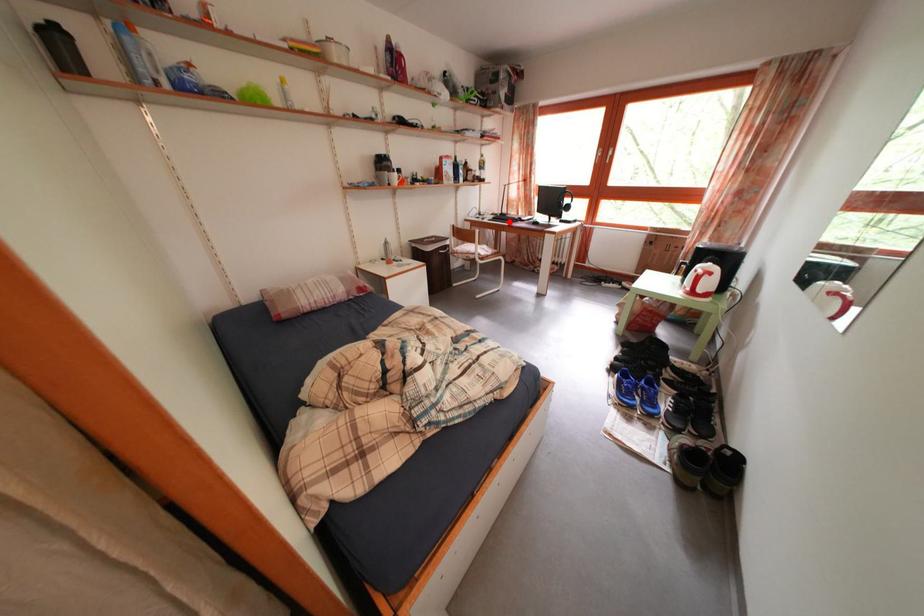
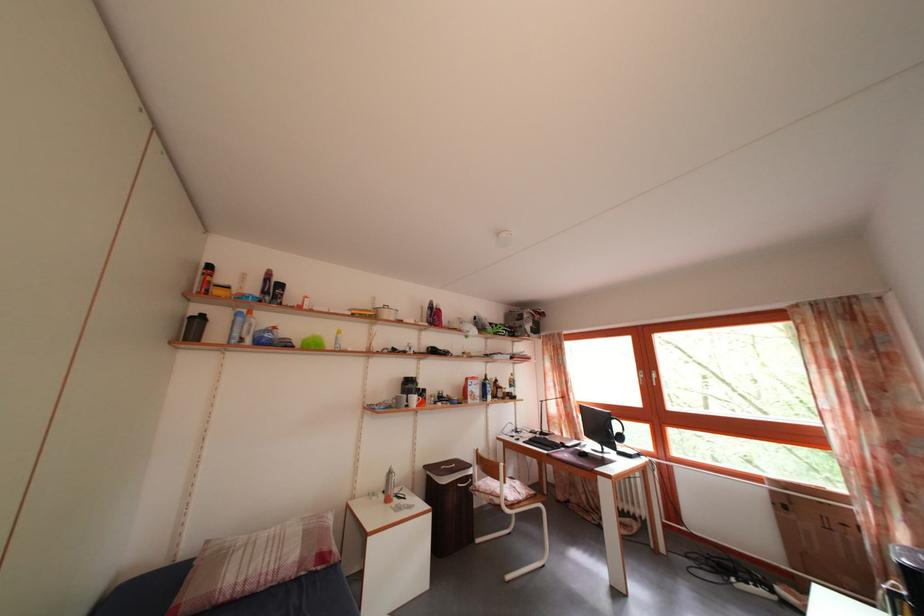
Question: I am providing you with two images of the same scene from different viewpoints. Given a red point in image1, look at the same physical point in image2. Is it:

Choices:
 (A) Closer to the viewpoint
 (B) Farther from the viewpoint

Answer: (B)